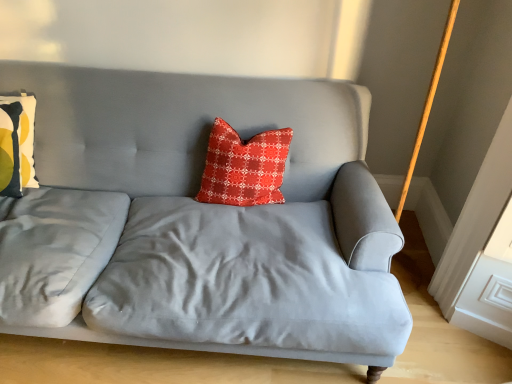
Question: Is satin gray couch at center bigger than matte yellow-green pillow at left, placed as the second pillow when sorted from right to left?

Choices:
 (A) no
 (B) yes

Answer: (B)

Question: Is satin gray couch at center outside matte yellow-green pillow at left, placed as the second pillow when sorted from right to left?

Choices:
 (A) no
 (B) yes

Answer: (B)

Question: Can you confirm if satin gray couch at center is positioned to the left of matte yellow-green pillow at left, which is the 1th pillow from left to right?

Choices:
 (A) yes
 (B) no

Answer: (B)

Question: Is satin gray couch at center oriented away from matte yellow-green pillow at left, which is the 1th pillow from left to right?

Choices:
 (A) no
 (B) yes

Answer: (B)

Question: Considering the relative sizes of satin gray couch at center and matte yellow-green pillow at left, placed as the second pillow when sorted from right to left, in the image provided, is satin gray couch at center shorter than matte yellow-green pillow at left, placed as the second pillow when sorted from right to left,?

Choices:
 (A) yes
 (B) no

Answer: (B)

Question: Are satin gray couch at center and matte yellow-green pillow at left, placed as the second pillow when sorted from right to left, located far from each other?

Choices:
 (A) yes
 (B) no

Answer: (B)

Question: From a real-world perspective, is red textured pillow at center, which is counted as the 1th pillow, starting from the right, located beneath satin gray couch at center?

Choices:
 (A) yes
 (B) no

Answer: (B)

Question: From the image's perspective, would you say red textured pillow at center, which is counted as the 1th pillow, starting from the right, is shown under satin gray couch at center?

Choices:
 (A) no
 (B) yes

Answer: (A)

Question: Is satin gray couch at center inside red textured pillow at center, which is the second pillow in left-to-right order?

Choices:
 (A) no
 (B) yes

Answer: (A)

Question: From the image's perspective, would you say red textured pillow at center, which is the second pillow in left-to-right order, is positioned over satin gray couch at center?

Choices:
 (A) yes
 (B) no

Answer: (A)

Question: Can you confirm if red textured pillow at center, which is the second pillow in left-to-right order, is positioned to the right of satin gray couch at center?

Choices:
 (A) no
 (B) yes

Answer: (B)

Question: Is red textured pillow at center, which is the second pillow in left-to-right order, in front of satin gray couch at center?

Choices:
 (A) yes
 (B) no

Answer: (B)

Question: Is the depth of red textured pillow at center, which is counted as the 1th pillow, starting from the right, greater than that of matte yellow-green pillow at left, placed as the second pillow when sorted from right to left?

Choices:
 (A) no
 (B) yes

Answer: (B)